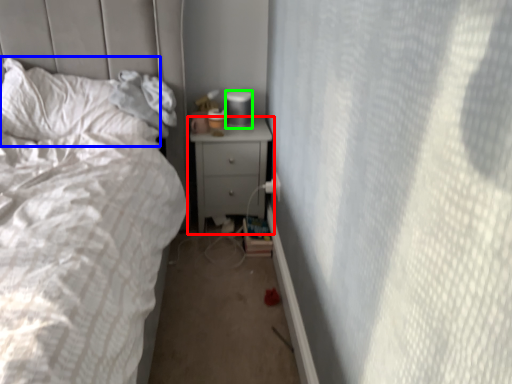
Question: Which object is positioned farthest from nightstand (highlighted by a red box)? Select from pillow (highlighted by a blue box) and gray (highlighted by a green box).

Choices:
 (A) pillow
 (B) gray

Answer: (A)